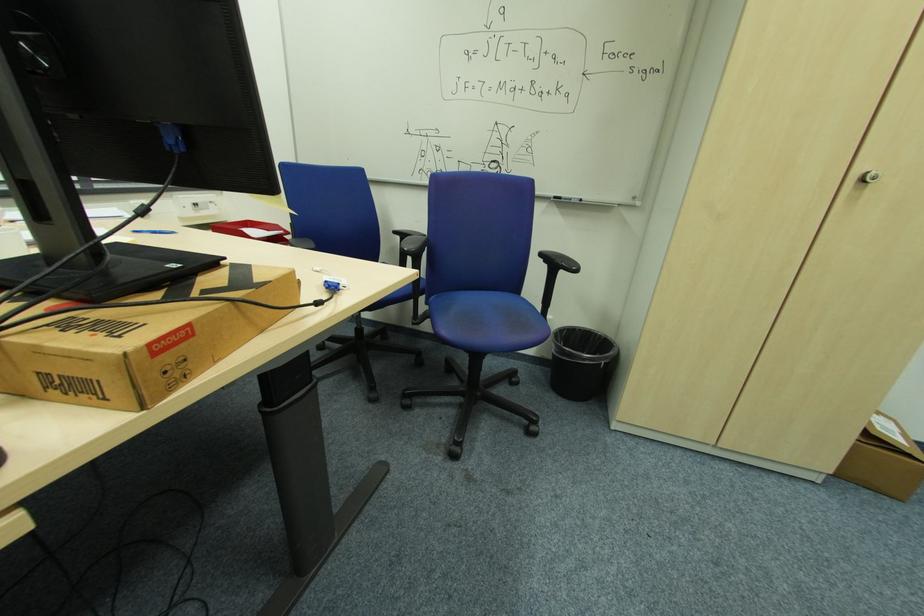
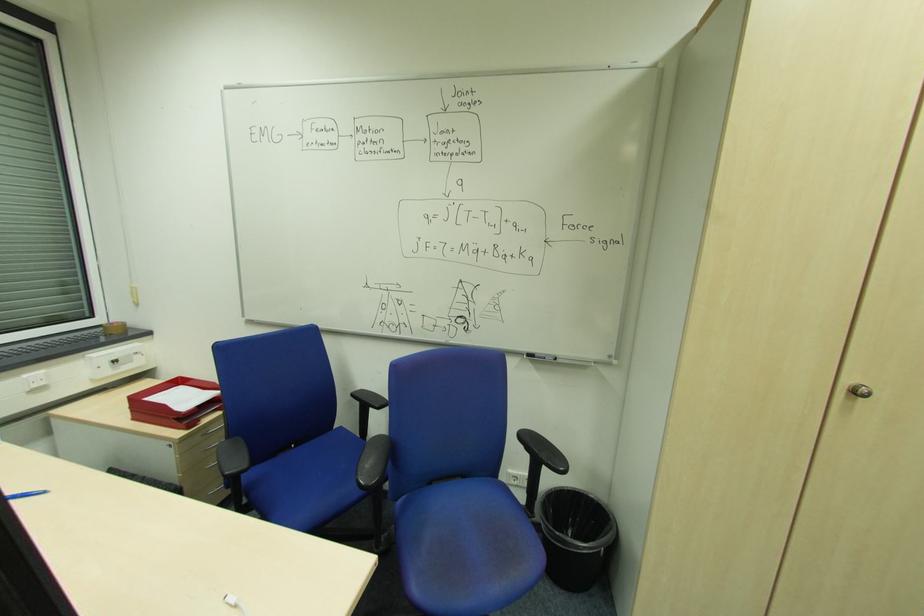
In the second image, find the point that corresponds to (602,336) in the first image.

(594, 499)